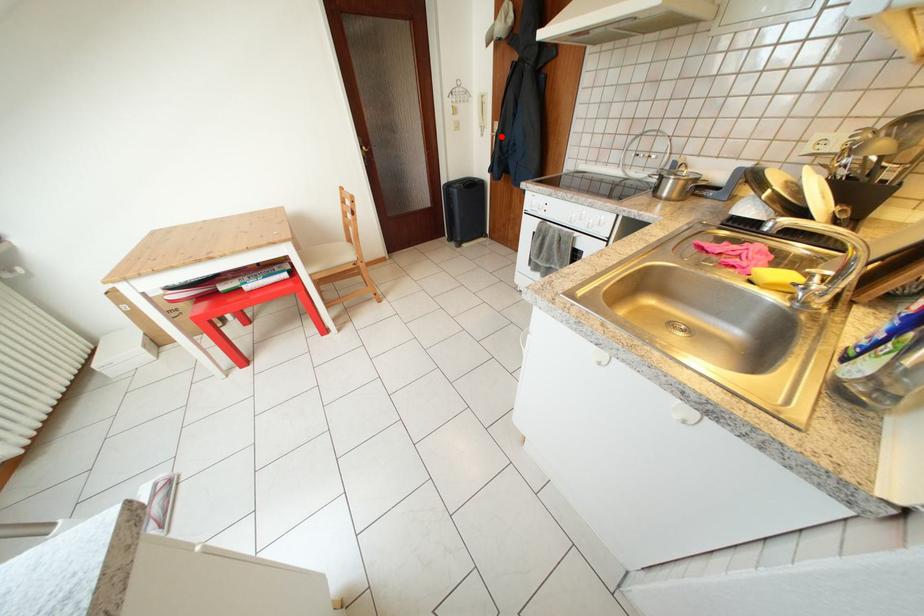
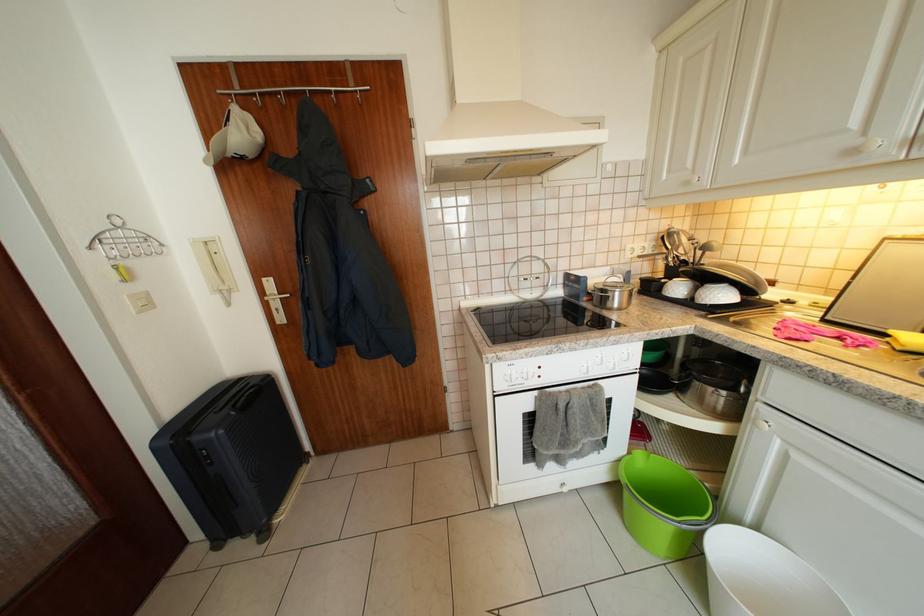
Question: I am providing you with two images of the same scene from different viewpoints. In image1, a red point is highlighted. Considering the same 3D point in image2, which of the following is correct?

Choices:
 (A) It is closer
 (B) It is farther

Answer: (B)